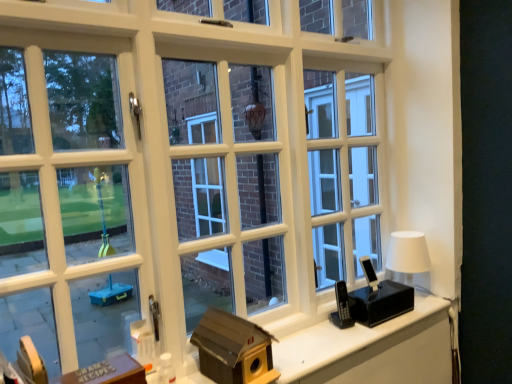
Question: Does white matte table lamp at right have a greater width compared to metallic silver buttons at lower left?

Choices:
 (A) no
 (B) yes

Answer: (B)

Question: From a real-world perspective, is white matte table lamp at right positioned under metallic silver buttons at lower left based on gravity?

Choices:
 (A) yes
 (B) no

Answer: (B)

Question: From the image's perspective, does white matte table lamp at right appear lower than metallic silver buttons at lower left?

Choices:
 (A) yes
 (B) no

Answer: (B)

Question: From a real-world perspective, does white matte table lamp at right stand above metallic silver buttons at lower left?

Choices:
 (A) no
 (B) yes

Answer: (B)

Question: Can you confirm if white matte table lamp at right is positioned to the right of metallic silver buttons at lower left?

Choices:
 (A) yes
 (B) no

Answer: (A)

Question: Is white matte table lamp at right facing away from metallic silver buttons at lower left?

Choices:
 (A) no
 (B) yes

Answer: (A)

Question: Is the surface of white matte table lamp at right in direct contact with brown cardboard birdhouse at center?

Choices:
 (A) no
 (B) yes

Answer: (A)

Question: Does white matte table lamp at right have a smaller size compared to brown cardboard birdhouse at center?

Choices:
 (A) yes
 (B) no

Answer: (A)

Question: Would you consider white matte table lamp at right to be distant from brown cardboard birdhouse at center?

Choices:
 (A) no
 (B) yes

Answer: (A)

Question: From the image's perspective, is white matte table lamp at right over brown cardboard birdhouse at center?

Choices:
 (A) yes
 (B) no

Answer: (A)

Question: From the image's perspective, would you say white matte table lamp at right is shown under brown cardboard birdhouse at center?

Choices:
 (A) yes
 (B) no

Answer: (B)

Question: From a real-world perspective, is white matte table lamp at right positioned over brown cardboard birdhouse at center based on gravity?

Choices:
 (A) no
 (B) yes

Answer: (B)

Question: Is metallic silver buttons at lower left facing away from wooden birdhouse at lower right?

Choices:
 (A) no
 (B) yes

Answer: (A)